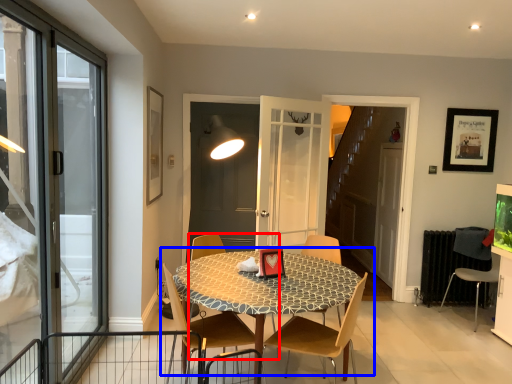
Question: Which object appears farthest to the camera in this image, chair (highlighted by a red box) or kitchen & dining room table (highlighted by a blue box)?

Choices:
 (A) chair
 (B) kitchen & dining room table

Answer: (A)